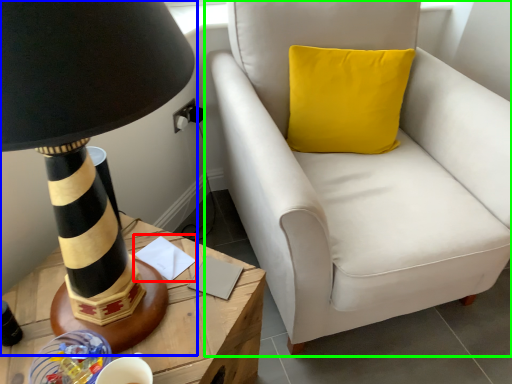
Question: Based on their relative distances, which object is farther from notepad (highlighted by a red box)? Choose from lamp (highlighted by a blue box) and chair (highlighted by a green box).

Choices:
 (A) lamp
 (B) chair

Answer: (B)